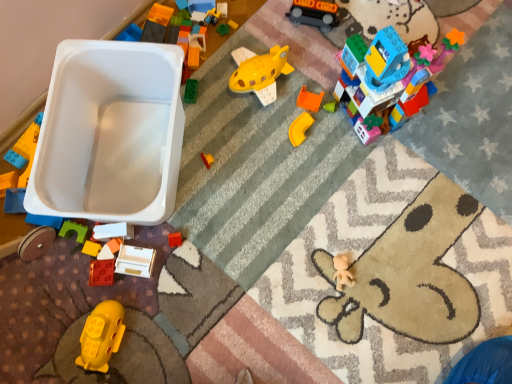
The width and height of the screenshot is (512, 384). What are the coordinates of `unoccupied region to the right of matte white drawer at lower center, positioned as the 4th toy in right-to-left order` in the screenshot? It's located at tap(199, 263).